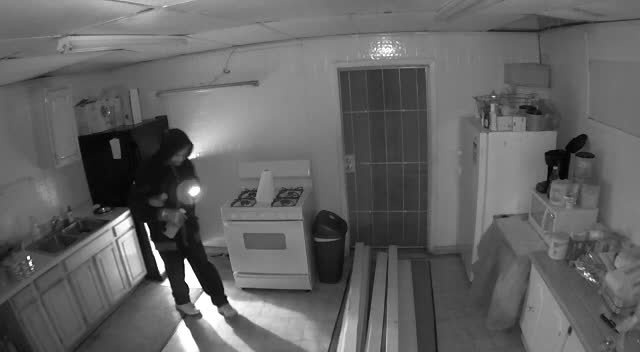
Identify the location of oven door. (290, 255).